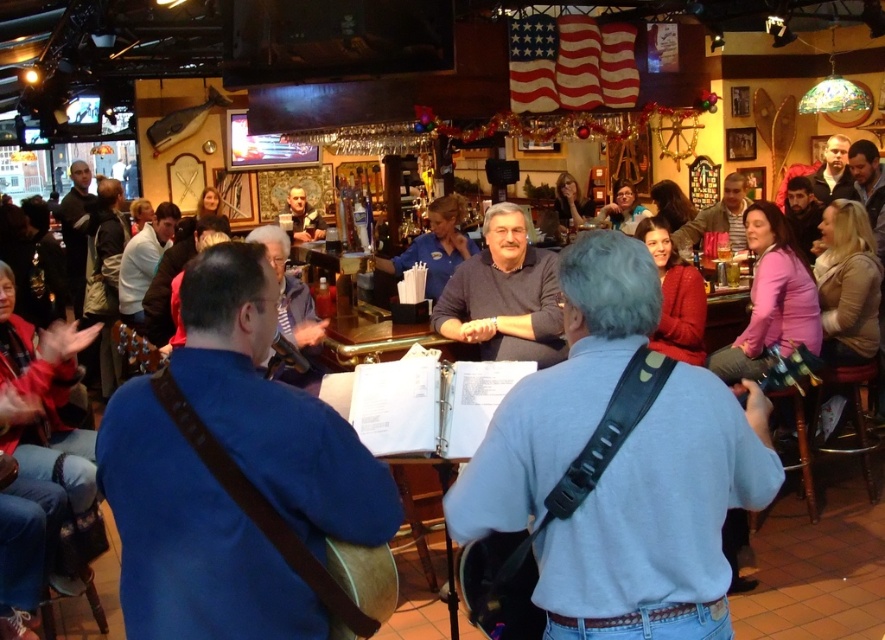
You are a photographer positioned in the middle of the room. You want to take a photo of the metallic gold guitar at center and the matte black sweater at upper center. Which object will appear larger in your photo?

The metallic gold guitar at center will appear larger in the photo because it is closer to the viewer than the matte black sweater at upper center.

You are a photographer standing at the entrance of the bar. You want to take a photo of the blue shirt at center and the wooden acoustic guitar at lower left without any obstructions. Based on their heights, which object might block the view of the other when framing the shot?

The blue shirt at center has a greater height compared to the wooden acoustic guitar at lower left, so the blue shirt at center might block the view of the wooden acoustic guitar at lower left when framing the shot.

You are a server at the bar and need to quickly grab the wooden acoustic guitar at lower left to give it back to a musician. You are currently standing next to the blue shirt at center. Can you reach the guitar without moving more than 8 feet?

The distance between blue shirt at center and wooden acoustic guitar at lower left is 7.95 feet, so yes, you can reach the guitar without moving more than 8 feet since the distance is just under the limit.